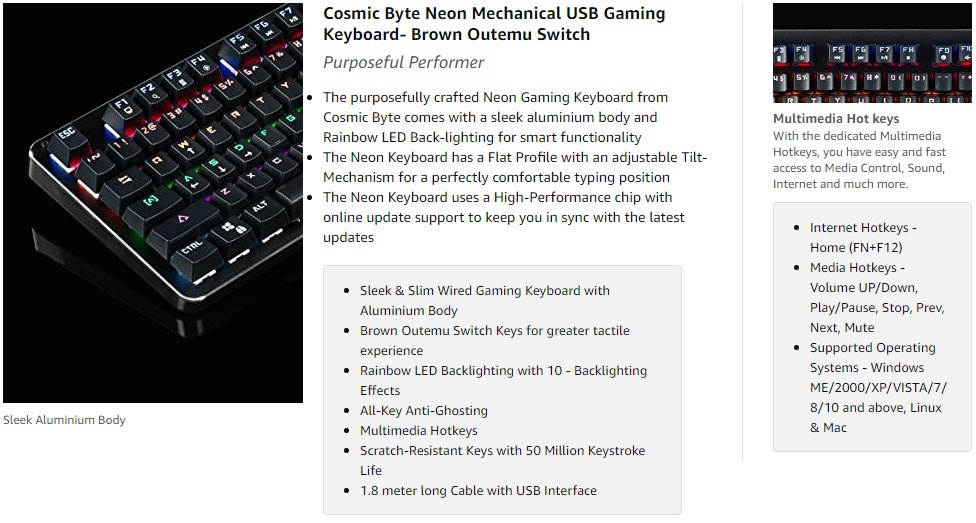
The width and height of the screenshot is (976, 523). In order to click on keyboard buttons in this screenshot , I will do `click(153, 169)`, `click(236, 139)`, `click(825, 93)`, `click(924, 63)`.